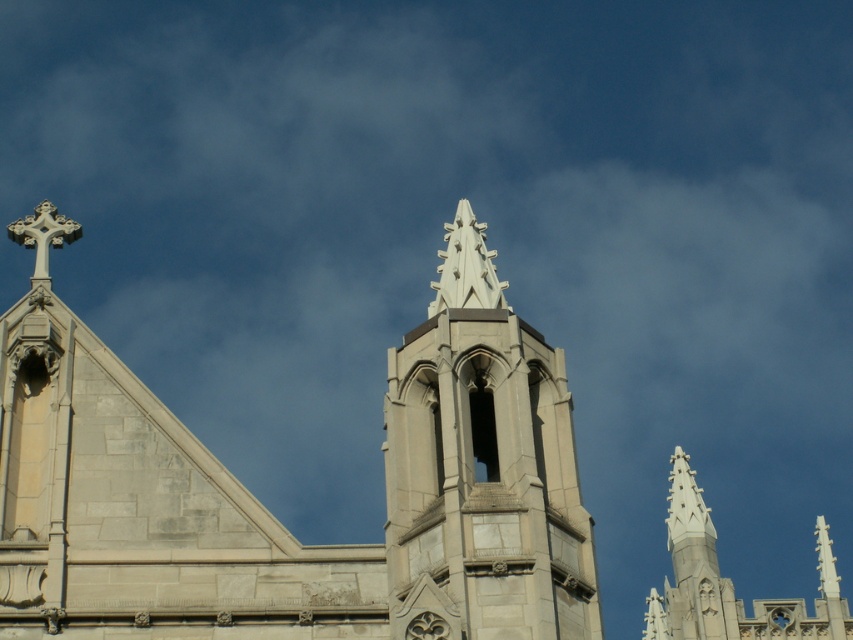
Question: Observing the image, what is the correct spatial positioning of gray stone church steeple at center in reference to white stone tower at center?

Choices:
 (A) right
 (B) left

Answer: (B)

Question: Does gray stone church steeple at center have a larger size compared to white stone tower at center?

Choices:
 (A) no
 (B) yes

Answer: (B)

Question: Which of the following is the closest to the observer?

Choices:
 (A) white stone tower at center
 (B) gray stone church steeple at center

Answer: (B)

Question: Which of the following is the farthest from the observer?

Choices:
 (A) (689, 602)
 (B) (479, 406)

Answer: (A)

Question: Is the position of gray stone church steeple at center less distant than that of white stone tower at center?

Choices:
 (A) no
 (B) yes

Answer: (B)